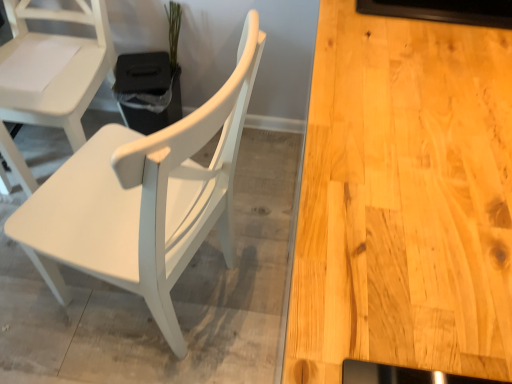
The height and width of the screenshot is (384, 512). What do you see at coordinates (51, 76) in the screenshot?
I see `white matte chair at left, acting as the second chair starting from the right` at bounding box center [51, 76].

You are a GUI agent. You are given a task and a screenshot of the screen. Output one action in this format:
    pyautogui.click(x=<x>, y=<y>)
    Task: Click on the white matte wood chair at left, which is the second chair in left-to-right order
    This screenshot has height=384, width=512.
    Given the screenshot: What is the action you would take?
    pyautogui.click(x=143, y=199)

Can you confirm if white matte wood chair at left, positioned as the first chair in right-to-left order, is wider than white matte chair at left, the 1th chair in the left-to-right sequence?

Correct, the width of white matte wood chair at left, positioned as the first chair in right-to-left order, exceeds that of white matte chair at left, the 1th chair in the left-to-right sequence.

Which point is more distant from viewer, (140, 288) or (46, 13)?

Point (46, 13)

Between white matte wood chair at left, which is the second chair in left-to-right order, and white matte chair at left, acting as the second chair starting from the right, which one appears on the left side from the viewer's perspective?

From the viewer's perspective, white matte chair at left, acting as the second chair starting from the right, appears more on the left side.

Find the location of a particular element. This screenshot has height=384, width=512. chair above the white matte chair at left, acting as the second chair starting from the right (from a real-world perspective) is located at coordinates coord(143,199).

Is green matte plant at upper center bigger than white matte chair at left, acting as the second chair starting from the right?

No, green matte plant at upper center is not bigger than white matte chair at left, acting as the second chair starting from the right.

From the image's perspective, starting from the green matte plant at upper center, which chair is the 1st one below? Please provide its 2D coordinates.

[(51, 76)]

Between green matte plant at upper center and white matte chair at left, the 1th chair in the left-to-right sequence, which one has larger width?

white matte chair at left, the 1th chair in the left-to-right sequence.

From the picture: From the image's perspective, is green matte plant at upper center above or below white matte chair at left, the 1th chair in the left-to-right sequence?

From the image's perspective, green matte plant at upper center appears above white matte chair at left, the 1th chair in the left-to-right sequence.

Which object is further away from the camera taking this photo, white matte wood chair at left, which is the second chair in left-to-right order, or green matte plant at upper center?

green matte plant at upper center is behind.

From the image's perspective, which is below, white matte wood chair at left, which is the second chair in left-to-right order, or green matte plant at upper center?

white matte wood chair at left, which is the second chair in left-to-right order, from the image's perspective.

From a real-world perspective, is white matte wood chair at left, positioned as the first chair in right-to-left order, beneath green matte plant at upper center?

Incorrect, from a real-world perspective, white matte wood chair at left, positioned as the first chair in right-to-left order, is higher than green matte plant at upper center.

Considering the relative sizes of white matte wood chair at left, positioned as the first chair in right-to-left order, and green matte plant at upper center in the image provided, is white matte wood chair at left, positioned as the first chair in right-to-left order, taller than green matte plant at upper center?

Yes.

Considering the relative positions of white matte chair at left, acting as the second chair starting from the right, and green matte plant at upper center in the image provided, is white matte chair at left, acting as the second chair starting from the right, to the right of green matte plant at upper center from the viewer's perspective?

No.

Is white matte chair at left, acting as the second chair starting from the right, aimed at green matte plant at upper center?

No.

Do you think white matte chair at left, acting as the second chair starting from the right, is within green matte plant at upper center, or outside of it?

white matte chair at left, acting as the second chair starting from the right, is not inside green matte plant at upper center, it's outside.

Considering the sizes of objects white matte chair at left, the 1th chair in the left-to-right sequence, and green matte plant at upper center in the image provided, who is smaller, white matte chair at left, the 1th chair in the left-to-right sequence, or green matte plant at upper center?

green matte plant at upper center is smaller.

Which is closer to the camera, (86, 91) or (88, 203)?

The point (88, 203) is more forward.

Considering the sizes of objects white matte chair at left, acting as the second chair starting from the right, and white matte wood chair at left, which is the second chair in left-to-right order, in the image provided, who is thinner, white matte chair at left, acting as the second chair starting from the right, or white matte wood chair at left, which is the second chair in left-to-right order,?

With smaller width is white matte chair at left, acting as the second chair starting from the right.

From a real-world perspective, is white matte chair at left, acting as the second chair starting from the right, positioned under white matte wood chair at left, which is the second chair in left-to-right order, based on gravity?

Yes.

Between white matte chair at left, the 1th chair in the left-to-right sequence, and white matte wood chair at left, which is the second chair in left-to-right order, which one appears on the left side from the viewer's perspective?

white matte chair at left, the 1th chair in the left-to-right sequence, is more to the left.

From a real-world perspective, which is physically above, green matte plant at upper center or white matte wood chair at left, positioned as the first chair in right-to-left order?

white matte wood chair at left, positioned as the first chair in right-to-left order, from a real-world perspective.

Is green matte plant at upper center oriented away from white matte wood chair at left, positioned as the first chair in right-to-left order?

No, green matte plant at upper center is not facing the opposite direction of white matte wood chair at left, positioned as the first chair in right-to-left order.

Does green matte plant at upper center lie in front of white matte wood chair at left, positioned as the first chair in right-to-left order?

No, it is not.

Where is `chair behind the white matte wood chair at left, positioned as the first chair in right-to-left order`? Image resolution: width=512 pixels, height=384 pixels. chair behind the white matte wood chair at left, positioned as the first chair in right-to-left order is located at coordinates (51, 76).

Find the location of a particular element. The height and width of the screenshot is (384, 512). chair on the left of green matte plant at upper center is located at coordinates (51, 76).

Considering their positions, is white matte chair at left, the 1th chair in the left-to-right sequence, positioned further to white matte wood chair at left, positioned as the first chair in right-to-left order, than green matte plant at upper center?

Among the two, green matte plant at upper center is located further to white matte wood chair at left, positioned as the first chair in right-to-left order.

Considering their positions, is white matte chair at left, the 1th chair in the left-to-right sequence, positioned closer to green matte plant at upper center than white matte wood chair at left, which is the second chair in left-to-right order?

white matte chair at left, the 1th chair in the left-to-right sequence, is positioned closer to the anchor green matte plant at upper center.

When comparing their distances from white matte wood chair at left, positioned as the first chair in right-to-left order, does green matte plant at upper center or white matte chair at left, acting as the second chair starting from the right, seem closer?

Based on the image, white matte chair at left, acting as the second chair starting from the right, appears to be nearer to white matte wood chair at left, positioned as the first chair in right-to-left order.

When comparing their distances from white matte chair at left, acting as the second chair starting from the right, does white matte wood chair at left, positioned as the first chair in right-to-left order, or green matte plant at upper center seem further?

Based on the image, white matte wood chair at left, positioned as the first chair in right-to-left order, appears to be further to white matte chair at left, acting as the second chair starting from the right.

Which object lies nearer to the anchor point green matte plant at upper center, white matte wood chair at left, which is the second chair in left-to-right order, or white matte chair at left, acting as the second chair starting from the right?

white matte chair at left, acting as the second chair starting from the right, is closer to green matte plant at upper center.

Estimate the real-world distances between objects in this image. Which object is closer to white matte chair at left, the 1th chair in the left-to-right sequence, green matte plant at upper center or white matte wood chair at left, which is the second chair in left-to-right order?

green matte plant at upper center is positioned closer to the anchor white matte chair at left, the 1th chair in the left-to-right sequence.

Image resolution: width=512 pixels, height=384 pixels. Find the location of `chair between white matte wood chair at left, which is the second chair in left-to-right order, and green matte plant at upper center from front to back`. chair between white matte wood chair at left, which is the second chair in left-to-right order, and green matte plant at upper center from front to back is located at coordinates (51, 76).